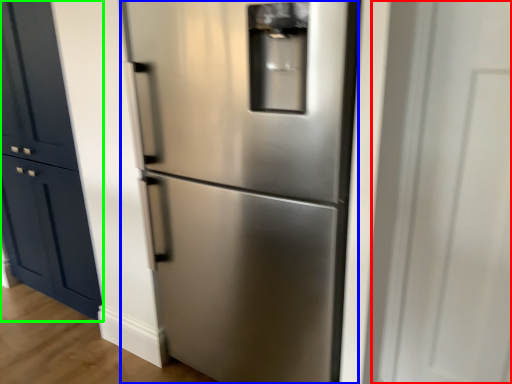
Question: Which object is the closest to the glass door (highlighted by a red box)? Choose among these: refrigerator (highlighted by a blue box) or door (highlighted by a green box).

Choices:
 (A) refrigerator
 (B) door

Answer: (A)